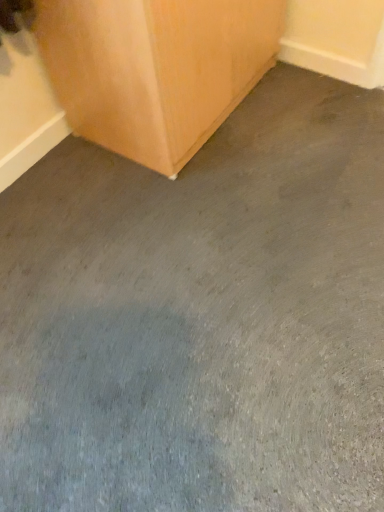
Locate an element on the screen. free point in front of light brown wood cabinet at upper left is located at coordinates (202, 215).